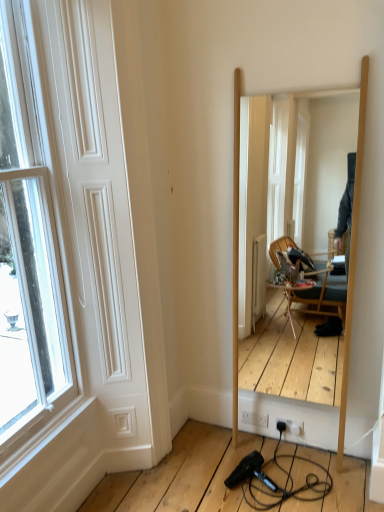
Question: Considering the relative sizes of wooden mirror at center and white matte door at left in the image provided, is wooden mirror at center wider than white matte door at left?

Choices:
 (A) no
 (B) yes

Answer: (B)

Question: Considering the relative sizes of wooden mirror at center and white matte door at left in the image provided, is wooden mirror at center smaller than white matte door at left?

Choices:
 (A) no
 (B) yes

Answer: (A)

Question: Is wooden mirror at center facing towards white matte door at left?

Choices:
 (A) yes
 (B) no

Answer: (B)

Question: Does wooden mirror at center have a lesser height compared to white matte door at left?

Choices:
 (A) yes
 (B) no

Answer: (A)

Question: From the image's perspective, does wooden mirror at center appear higher than white matte door at left?

Choices:
 (A) no
 (B) yes

Answer: (B)

Question: Based on their sizes in the image, would you say black plastic hair dryer at lower center is bigger or smaller than white matte door at left?

Choices:
 (A) big
 (B) small

Answer: (B)

Question: Considering the positions of point (266, 480) and point (117, 60), is point (266, 480) closer or farther from the camera than point (117, 60)?

Choices:
 (A) farther
 (B) closer

Answer: (A)

Question: Is black plastic hair dryer at lower center in front of or behind white matte door at left in the image?

Choices:
 (A) behind
 (B) front

Answer: (A)

Question: Would you say black plastic hair dryer at lower center is to the left or to the right of white matte door at left in the picture?

Choices:
 (A) left
 (B) right

Answer: (B)

Question: Does point (112, 232) appear closer or farther from the camera than point (266, 329)?

Choices:
 (A) farther
 (B) closer

Answer: (B)

Question: From a real-world perspective, is white matte door at left positioned above or below wooden mirror at center?

Choices:
 (A) below
 (B) above

Answer: (B)

Question: Is white matte door at left taller or shorter than wooden mirror at center?

Choices:
 (A) tall
 (B) short

Answer: (A)

Question: Is white matte door at left spatially inside wooden mirror at center, or outside of it?

Choices:
 (A) inside
 (B) outside

Answer: (B)

Question: From the image's perspective, is wooden mirror at center above or below white matte door at left?

Choices:
 (A) above
 (B) below

Answer: (A)

Question: From a real-world perspective, is wooden mirror at center physically located above or below white matte door at left?

Choices:
 (A) below
 (B) above

Answer: (A)